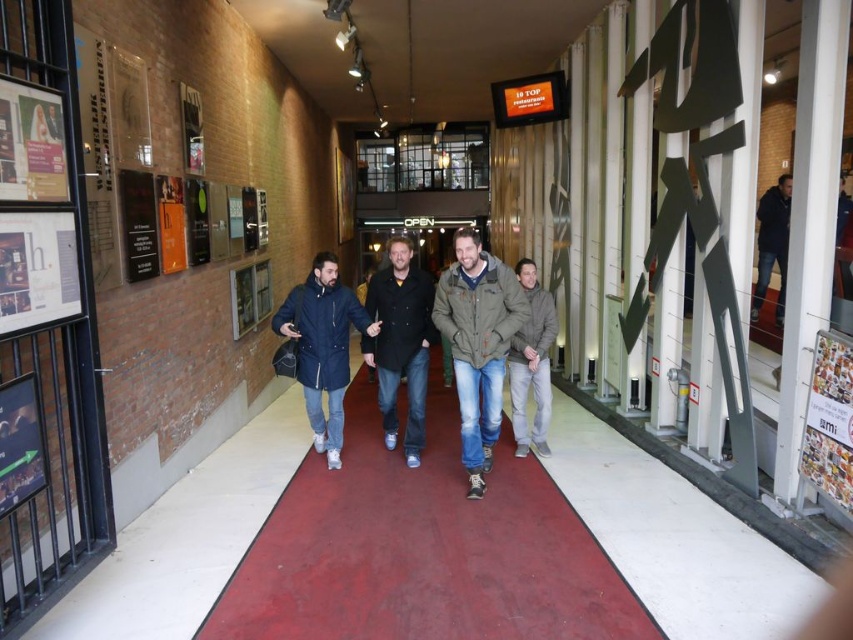
Can you confirm if green textured jacket at center is smaller than matte black coat at center?

Correct, green textured jacket at center occupies less space than matte black coat at center.

Does green textured jacket at center lie behind matte black coat at center?

No, green textured jacket at center is closer to the viewer.

Is point (490, 426) closer to camera compared to point (308, 332)?

Yes, point (490, 426) is closer to viewer.

What are the coordinates of `green textured jacket at center` in the screenshot? It's located at (479, 342).

Who is taller, green textured jacket at center or dark blue jeans at right?

Standing taller between the two is green textured jacket at center.

Does green textured jacket at center have a smaller size compared to dark blue jeans at right?

Correct, green textured jacket at center occupies less space than dark blue jeans at right.

Does point (479, 346) come behind point (759, 211)?

No, it is in front of (759, 211).

Where is `green textured jacket at center`? green textured jacket at center is located at coordinates (479, 342).

Is rubberized red carpet at center taller than matte black coat at center?

In fact, rubberized red carpet at center may be shorter than matte black coat at center.

Image resolution: width=853 pixels, height=640 pixels. What do you see at coordinates (422, 550) in the screenshot?
I see `rubberized red carpet at center` at bounding box center [422, 550].

Find the location of `rubberized red carpet at center`. rubberized red carpet at center is located at coordinates (422, 550).